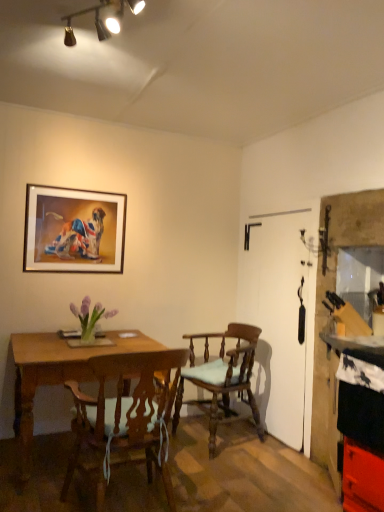
Describe the element at coordinates (221, 378) in the screenshot. I see `wooden chair with cushion at center, which appears as the 1th chair when viewed from the back` at that location.

Describe the element at coordinates (74, 230) in the screenshot. I see `wooden framed picture at upper left` at that location.

The height and width of the screenshot is (512, 384). What do you see at coordinates (127, 416) in the screenshot?
I see `wooden chair with cushion at center, which is the first chair from front to back` at bounding box center [127, 416].

Measure the distance between point (353, 322) and camera.

Point (353, 322) and camera are 8.65 feet apart from each other.

Image resolution: width=384 pixels, height=512 pixels. Describe the element at coordinates (90, 317) in the screenshot. I see `purple glass vase at center` at that location.

At what (x,y) coordinates should I click in order to perform the action: click on wooden chair with cushion at center, which ranks as the second chair in front-to-back order. Please return your answer as a coordinate pair (x, y). The image size is (384, 512). Looking at the image, I should click on (221, 378).

Is wooden framed picture at upper left to the left of wooden chair with cushion at center, which is the first chair from front to back, from the viewer's perspective?

Yes, wooden framed picture at upper left is to the left of wooden chair with cushion at center, which is the first chair from front to back.

Is wooden framed picture at upper left aimed at wooden chair with cushion at center, positioned as the second chair in back-to-front order?

No.

Considering the sizes of wooden framed picture at upper left and wooden chair with cushion at center, which is the first chair from front to back, in the image, is wooden framed picture at upper left taller or shorter than wooden chair with cushion at center, which is the first chair from front to back,?

In the image, wooden framed picture at upper left appears to be shorter than wooden chair with cushion at center, which is the first chair from front to back.

Considering the positions of objects smooth black countertop at right and wooden framed picture at upper left in the image provided, who is behind, smooth black countertop at right or wooden framed picture at upper left?

wooden framed picture at upper left is further away from the camera.

Does point (370, 493) appear closer or farther from the camera than point (59, 199)?

Clearly, point (370, 493) is closer to the camera than point (59, 199).

From the picture: Considering the sizes of objects smooth black countertop at right and wooden framed picture at upper left in the image provided, who is wider, smooth black countertop at right or wooden framed picture at upper left?

Wider between the two is smooth black countertop at right.

Is wooden framed picture at upper left a part of smooth black countertop at right?

No, wooden framed picture at upper left is not inside smooth black countertop at right.

The image size is (384, 512). In the image, there is a wooden chair with cushion at center, which appears as the 1th chair when viewed from the back. Find the location of `counter below it (from the image's perspective)`. counter below it (from the image's perspective) is located at coordinates (346, 436).

Considering the relative positions of wooden chair with cushion at center, which ranks as the second chair in front-to-back order, and smooth black countertop at right in the image provided, is wooden chair with cushion at center, which ranks as the second chair in front-to-back order, to the right of smooth black countertop at right from the viewer's perspective?

No, wooden chair with cushion at center, which ranks as the second chair in front-to-back order, is not to the right of smooth black countertop at right.

Which is in front, wooden chair with cushion at center, which appears as the 1th chair when viewed from the back, or smooth black countertop at right?

smooth black countertop at right.

Is wooden chair with cushion at center, which ranks as the second chair in front-to-back order, turned away from smooth black countertop at right?

No, smooth black countertop at right is not at the back of wooden chair with cushion at center, which ranks as the second chair in front-to-back order.

Can you confirm if wooden chair with cushion at center, which is the first chair from front to back, is wider than purple glass vase at center?

Yes, wooden chair with cushion at center, which is the first chair from front to back, is wider than purple glass vase at center.

What's the angular difference between wooden chair with cushion at center, which is the first chair from front to back, and purple glass vase at center's facing directions?

174 degrees.

Considering the relative positions of wooden chair with cushion at center, which is the first chair from front to back, and purple glass vase at center in the image provided, is wooden chair with cushion at center, which is the first chair from front to back, to the left of purple glass vase at center from the viewer's perspective?

Incorrect, wooden chair with cushion at center, which is the first chair from front to back, is not on the left side of purple glass vase at center.

From the image's perspective, is wooden chair with cushion at center, which is the first chair from front to back, under purple glass vase at center?

Yes.

In terms of size, does smooth black countertop at right appear bigger or smaller than wooden chair with cushion at center, which ranks as the second chair in front-to-back order?

Considering their sizes, smooth black countertop at right takes up more space than wooden chair with cushion at center, which ranks as the second chair in front-to-back order.

How much distance is there between smooth black countertop at right and wooden chair with cushion at center, which appears as the 1th chair when viewed from the back?

The distance of smooth black countertop at right from wooden chair with cushion at center, which appears as the 1th chair when viewed from the back, is 34.99 inches.

Between smooth black countertop at right and wooden chair with cushion at center, which ranks as the second chair in front-to-back order, which one is positioned behind?

wooden chair with cushion at center, which ranks as the second chair in front-to-back order, is more distant.

Identify the location of chair behind the smooth black countertop at right. The width and height of the screenshot is (384, 512). (221, 378).

From the image's perspective, between purple glass vase at center and wooden chair with cushion at center, which is the first chair from front to back, which one is located above?

From the image's view, purple glass vase at center is above.

What's the angular difference between purple glass vase at center and wooden chair with cushion at center, positioned as the second chair in back-to-front order,'s facing directions?

The facing directions of purple glass vase at center and wooden chair with cushion at center, positioned as the second chair in back-to-front order, are 174 degrees apart.

Is purple glass vase at center bigger than wooden chair with cushion at center, which is the first chair from front to back?

No, purple glass vase at center is not bigger than wooden chair with cushion at center, which is the first chair from front to back.

Is purple glass vase at center to the right of wooden chair with cushion at center, which is the first chair from front to back, from the viewer's perspective?

No, purple glass vase at center is not to the right of wooden chair with cushion at center, which is the first chair from front to back.

Which object is further away from the camera taking this photo, wooden table at left or wooden framed picture at upper left?

wooden framed picture at upper left is more distant.

Is point (47, 350) positioned after point (67, 195)?

No, it is not.

Identify the location of picture frame above the wooden table at left (from a real-world perspective). The image size is (384, 512). (74, 230).

Considering the relative sizes of wooden table at left and wooden framed picture at upper left in the image provided, is wooden table at left wider than wooden framed picture at upper left?

Indeed, wooden table at left has a greater width compared to wooden framed picture at upper left.

I want to click on the 2nd chair in front when counting from the wooden framed picture at upper left, so (x=127, y=416).

What are the coordinates of `picture frame above the smooth black countertop at right (from a real-world perspective)` in the screenshot? It's located at (74, 230).

Considering their positions, is wooden framed picture at upper left positioned further to wooden chair with cushion at center, which appears as the 1th chair when viewed from the back, than wooden chair with cushion at center, positioned as the second chair in back-to-front order?

Among the two, wooden framed picture at upper left is located further to wooden chair with cushion at center, which appears as the 1th chair when viewed from the back.

From the image, which object appears to be nearer to wooden chair with cushion at center, which ranks as the second chair in front-to-back order, wooden table at left or smooth black countertop at right?

smooth black countertop at right is closer to wooden chair with cushion at center, which ranks as the second chair in front-to-back order.

Based on their spatial positions, is smooth black countertop at right or purple glass vase at center closer to wooden framed picture at upper left?

purple glass vase at center lies closer to wooden framed picture at upper left than the other object.

Considering their positions, is smooth black countertop at right positioned closer to wooden framed picture at upper left than wooden table at left?

The object closer to wooden framed picture at upper left is wooden table at left.

From the image, which object appears to be farther from wooden chair with cushion at center, which is the first chair from front to back, purple glass vase at center or wooden framed picture at upper left?

The object further to wooden chair with cushion at center, which is the first chair from front to back, is wooden framed picture at upper left.

Which object lies further to the anchor point wooden table at left, purple glass vase at center or wooden chair with cushion at center, which appears as the 1th chair when viewed from the back?

wooden chair with cushion at center, which appears as the 1th chair when viewed from the back, is further to wooden table at left.

Considering their positions, is wooden chair with cushion at center, which appears as the 1th chair when viewed from the back, positioned further to wooden framed picture at upper left than smooth black countertop at right?

smooth black countertop at right is further to wooden framed picture at upper left.

From the image, which object appears to be farther from wooden chair with cushion at center, which is the first chair from front to back, smooth black countertop at right or purple glass vase at center?

The object further to wooden chair with cushion at center, which is the first chair from front to back, is smooth black countertop at right.

You are a GUI agent. You are given a task and a screenshot of the screen. Output one action in this format:
    pyautogui.click(x=<x>, y=<y>)
    Task: Click on the flower between wooden framed picture at upper left and smooth black countertop at right in the horizontal direction
    The image size is (384, 512).
    Given the screenshot: What is the action you would take?
    pyautogui.click(x=90, y=317)

At what (x,y) coordinates should I click in order to perform the action: click on flower situated between wooden framed picture at upper left and wooden chair with cushion at center, which appears as the 1th chair when viewed from the back, from left to right. Please return your answer as a coordinate pair (x, y). Image resolution: width=384 pixels, height=512 pixels. Looking at the image, I should click on (90, 317).

I want to click on desk situated between wooden framed picture at upper left and smooth black countertop at right from left to right, so click(x=56, y=373).

This screenshot has width=384, height=512. Find the location of `chair between wooden chair with cushion at center, which is the first chair from front to back, and smooth black countertop at right, in the horizontal direction`. chair between wooden chair with cushion at center, which is the first chair from front to back, and smooth black countertop at right, in the horizontal direction is located at coordinates (221, 378).